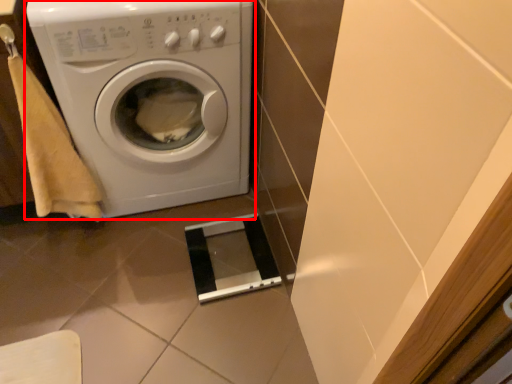
Question: Where is washing machine (annotated by the red box) located in relation to hand towel in the image?

Choices:
 (A) left
 (B) right

Answer: (B)